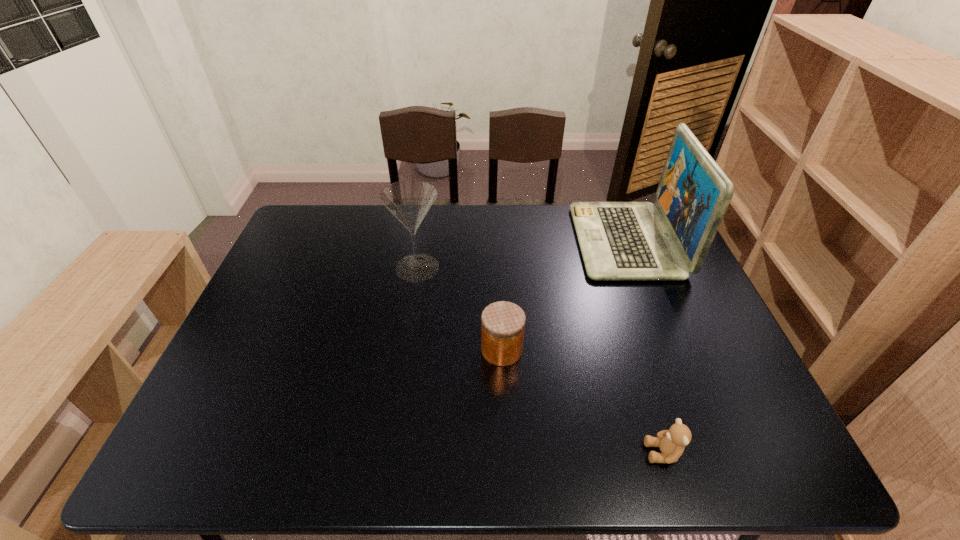
Find the location of `vacant region located on the front of the second tallest object`. vacant region located on the front of the second tallest object is located at coordinates (400, 380).

Identify the location of vacant space located on the front of the second shortest object. Image resolution: width=960 pixels, height=540 pixels. (507, 458).

Identify the location of vacant space located 0.150m on the face of the nearest object. The height and width of the screenshot is (540, 960). (575, 453).

Locate an element on the screen. free point located 0.190m on the face of the nearest object is located at coordinates (556, 453).

I want to click on vacant space located 0.290m on the face of the nearest object, so click(x=509, y=453).

Locate an element on the screen. The image size is (960, 540). object located in the far edge section of the desktop is located at coordinates (618, 240).

This screenshot has width=960, height=540. Find the location of `object at the near edge`. object at the near edge is located at coordinates (672, 442).

Find the location of `object located at the right edge`. object located at the right edge is located at coordinates (618, 240).

Where is `object at the far right corner`? This screenshot has height=540, width=960. object at the far right corner is located at coordinates (618, 240).

Locate an element on the screen. The image size is (960, 540). vacant position at the far edge of the desktop is located at coordinates (356, 205).